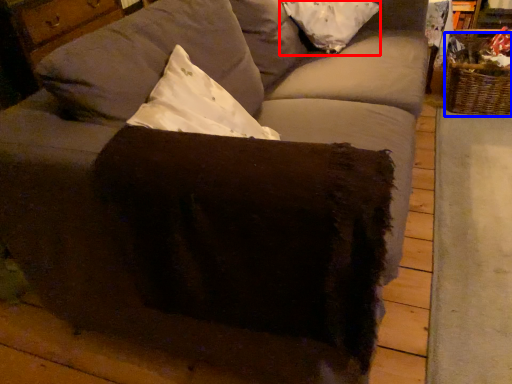
Question: Which point is closer to the camera, pillow (highlighted by a red box) or basket (highlighted by a blue box)?

Choices:
 (A) pillow
 (B) basket

Answer: (A)